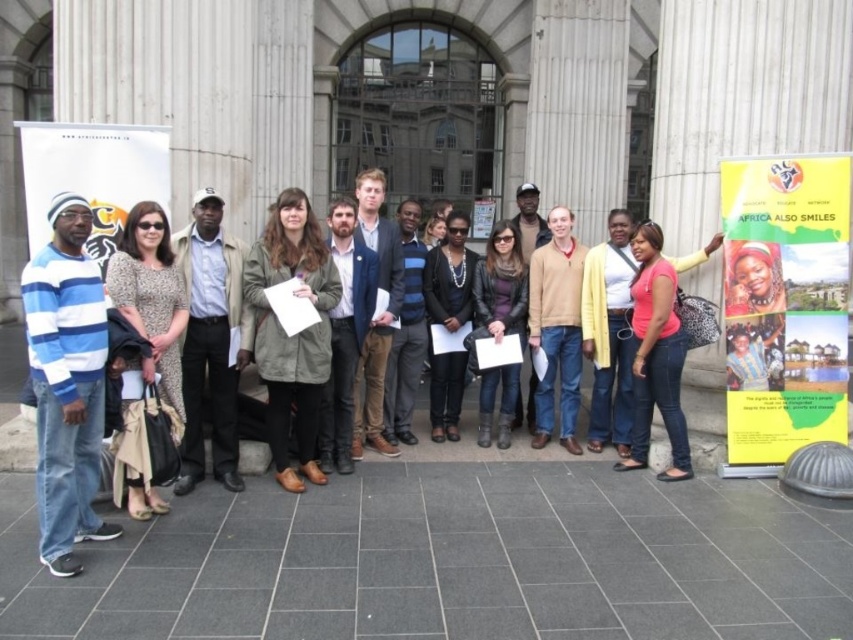
Is point (213, 413) more distant than point (524, 324)?

No, (213, 413) is in front of (524, 324).

Who is more forward, (184, 461) or (500, 257)?

Point (184, 461) is more forward.

Locate an element on the screen. Image resolution: width=853 pixels, height=640 pixels. light brown leather jacket at center is located at coordinates (212, 340).

Is white paper at left shorter than tan sweater at center?

In fact, white paper at left may be taller than tan sweater at center.

Between white paper at left and tan sweater at center, which one has less height?

Standing shorter between the two is tan sweater at center.

Which is in front, point (28, 224) or point (532, 330)?

Point (28, 224)

Where is `white paper at left`? This screenshot has height=640, width=853. white paper at left is located at coordinates (91, 176).

Between blue striped sweater at left and white paper at left, which one is positioned higher?

white paper at left is above.

What do you see at coordinates (67, 381) in the screenshot? This screenshot has width=853, height=640. I see `blue striped sweater at left` at bounding box center [67, 381].

Which is behind, point (53, 465) or point (148, 141)?

The point (148, 141) is behind.

At what (x,y) coordinates should I click in order to perform the action: click on blue striped sweater at left. Please return your answer as a coordinate pair (x, y). This screenshot has height=640, width=853. Looking at the image, I should click on (67, 381).